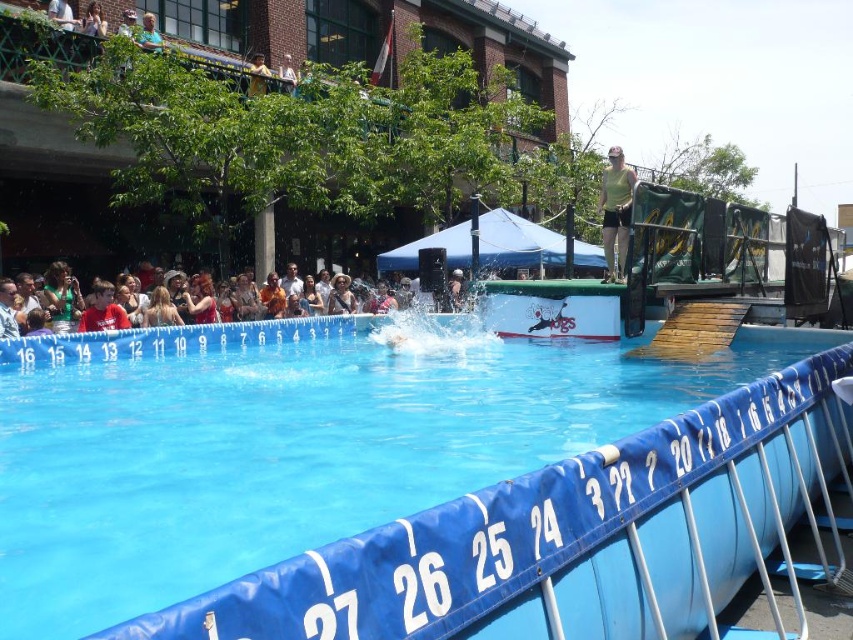
Does leather jacket at center appear under light brown leather hat at upper center?

Correct, leather jacket at center is located below light brown leather hat at upper center.

Who is taller, leather jacket at center or light brown leather hat at upper center?

With more height is light brown leather hat at upper center.

Which is behind, point (270, 280) or point (343, 278)?

Point (343, 278)

Find the location of a particular element. leather jacket at center is located at coordinates (271, 298).

Is the position of green fabric shirt at left more distant than that of leather jacket at center?

No, it is not.

Can you confirm if green fabric shirt at left is wider than leather jacket at center?

Indeed, green fabric shirt at left has a greater width compared to leather jacket at center.

Identify the location of green fabric shirt at left. This screenshot has width=853, height=640. (62, 296).

Find the location of a particular element. This screenshot has height=640, width=853. green fabric shirt at left is located at coordinates (62, 296).

Is multicolored casual clothing at lower center bigger than matte brown hair at center?

Indeed, multicolored casual clothing at lower center has a larger size compared to matte brown hair at center.

This screenshot has width=853, height=640. In order to click on multicolored casual clothing at lower center in this screenshot , I will do (202, 308).

Between point (224, 314) and point (236, 289), which one is positioned behind?

The point (236, 289) is behind.

Where is `multicolored casual clothing at lower center`? The image size is (853, 640). multicolored casual clothing at lower center is located at coordinates (202, 308).